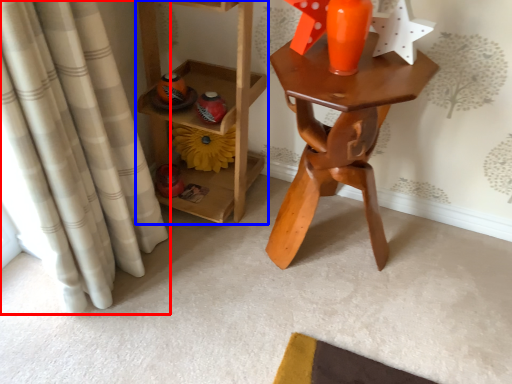
Question: Which point is further to the camera, curtain (highlighted by a red box) or furniture (highlighted by a blue box)?

Choices:
 (A) curtain
 (B) furniture

Answer: (B)